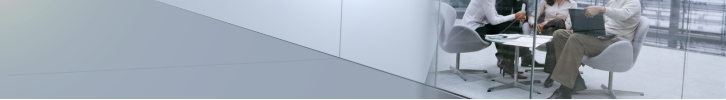
Locate an element on the screen. The image size is (726, 100). laptop computer is located at coordinates (584, 28).